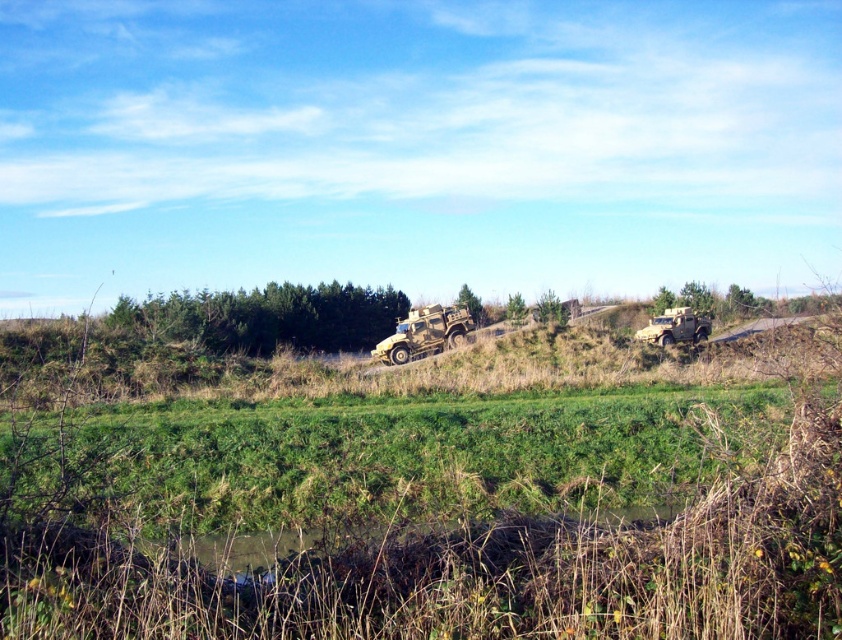
You are a soldier standing at the edge of the grassy area in the rural landscape. You need to reach the camouflage fabric military vehicle at center. Given that your maximum jumping distance between two points is 4 meters, how many jumps do you estimate you would need to make to reach the vehicle?

The camouflage fabric military vehicle at center is 42.92 meters away from you. Since your maximum jump distance is 4 meters, you would need to make approximately 11 jumps to reach it.

You are a drone operator tasked with landing a drone on the camouflage fabric military vehicle at center. Given the coordinates provided in the Objects Description, can you confirm if the vehicle is positioned at the center of the image?

The camouflage fabric military vehicle at center is located at point (425, 333), which is very close to the center coordinates of an image, typically at (421, 320). Therefore, it can be confirmed that the camouflage fabric military vehicle at center is indeed positioned near the center of the image.

You are a soldier navigating through the rural landscape depicted. You need to reach the camouflage fabric military vehicle at center. From your current position at point (425, 333), which direction should you move to reach it?

The camouflage fabric military vehicle at center is located exactly at your current position at point (425, 333), so you don not need to move in any direction.